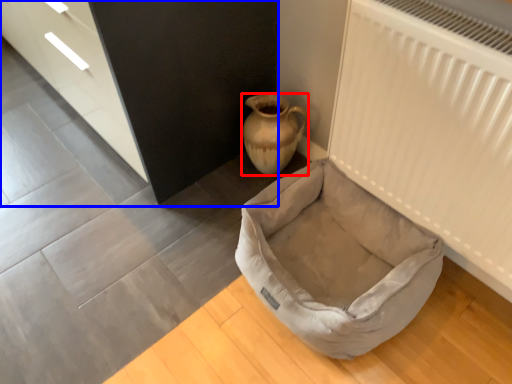
Question: Which point is closer to the camera, vase (highlighted by a red box) or dresser (highlighted by a blue box)?

Choices:
 (A) vase
 (B) dresser

Answer: (B)